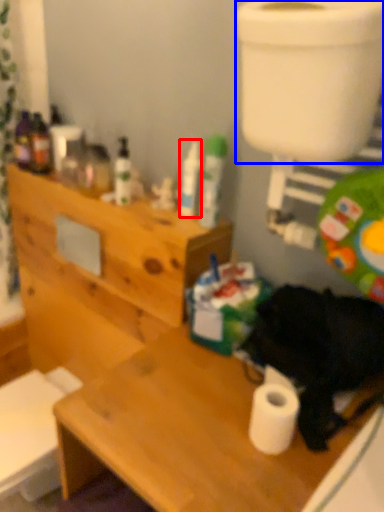
Question: Which of the following is the closest to the observer, toiletry (highlighted by a red box) or toilet bowl (highlighted by a blue box)?

Choices:
 (A) toiletry
 (B) toilet bowl

Answer: (B)